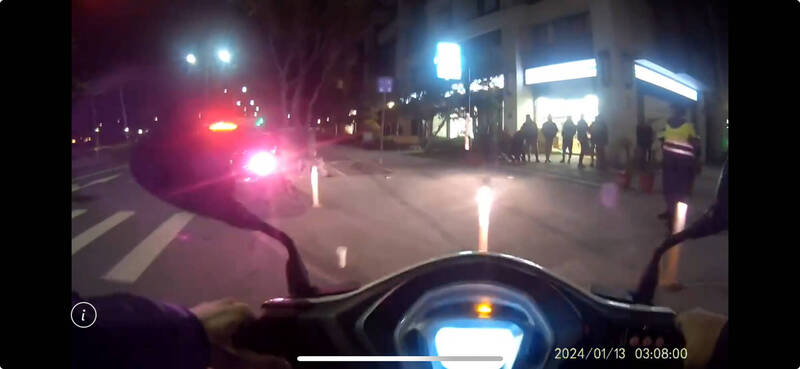
Where is `store lights`? store lights is located at coordinates (560, 69), (497, 78), (656, 75).